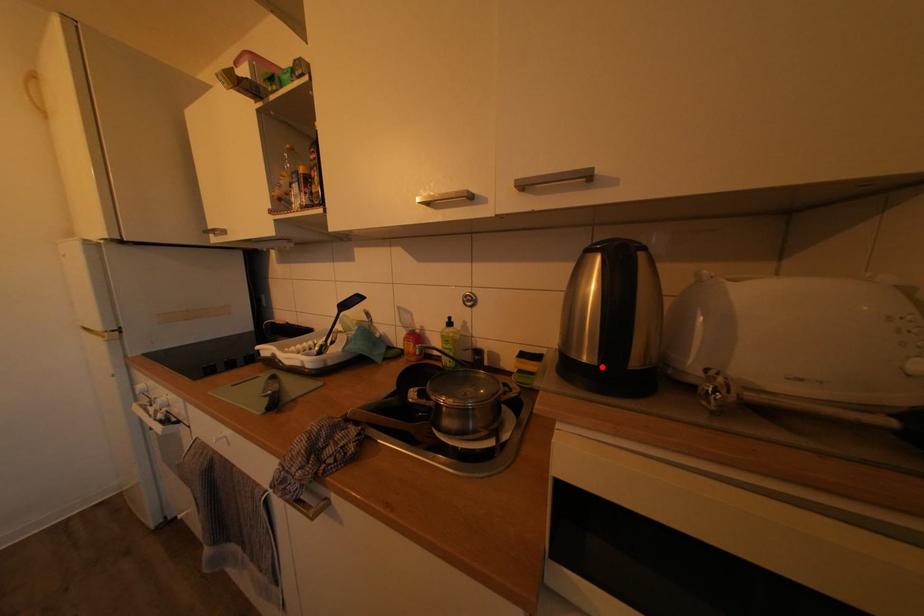
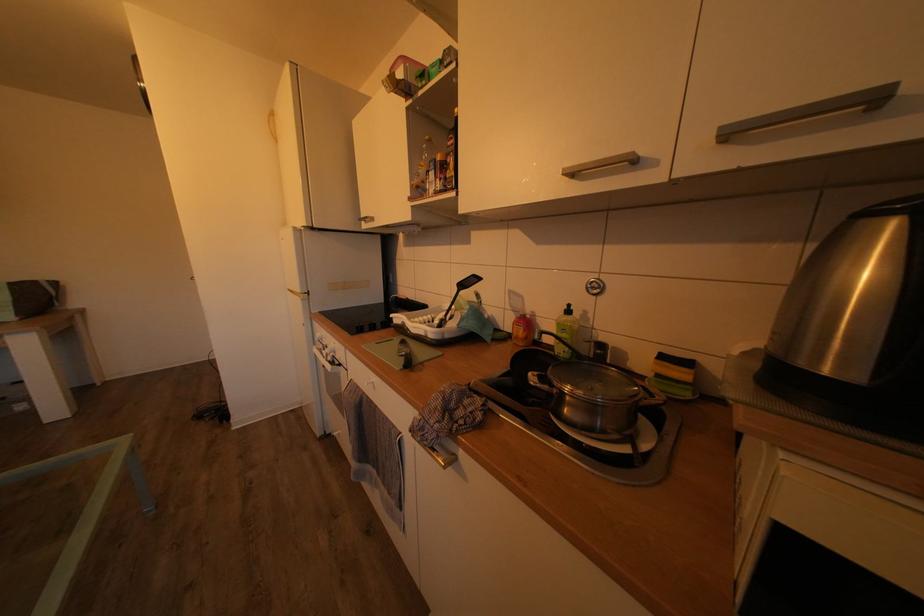
Find the pixel in the second image that matches the highlighted location in the first image.

(868, 385)